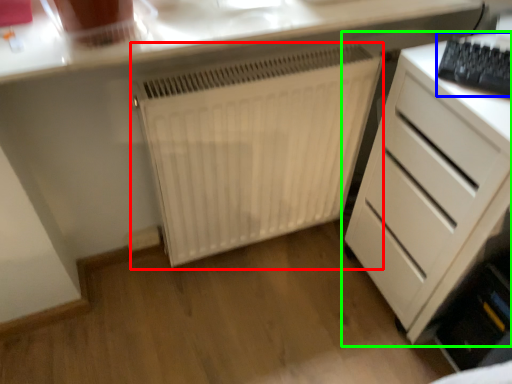
Question: Which object is the closest to the radiator (highlighted by a red box)? Choose among these: keyboard (highlighted by a blue box) or chest of drawers (highlighted by a green box).

Choices:
 (A) keyboard
 (B) chest of drawers

Answer: (B)